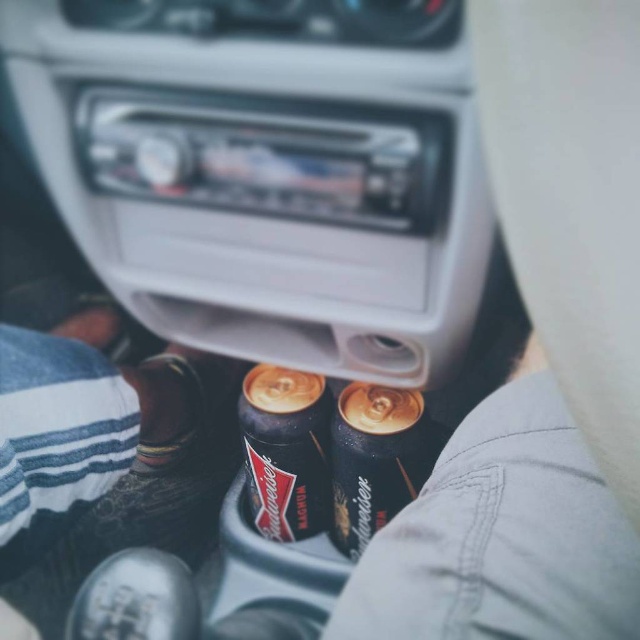
Question: Does shiny black can at center have a lesser width compared to shiny gold can at center?

Choices:
 (A) yes
 (B) no

Answer: (A)

Question: Which point appears farthest from the camera in this image?

Choices:
 (A) (314, 516)
 (B) (342, 516)

Answer: (A)

Question: Is shiny black can at center positioned in front of shiny gold can at center?

Choices:
 (A) yes
 (B) no

Answer: (B)

Question: Does shiny black can at center have a larger size compared to shiny gold can at center?

Choices:
 (A) yes
 (B) no

Answer: (B)